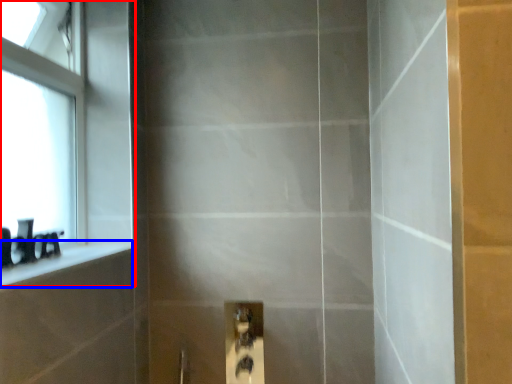
Question: Which object appears closest to the camera in this image, window (highlighted by a red box) or ledge (highlighted by a blue box)?

Choices:
 (A) window
 (B) ledge

Answer: (B)